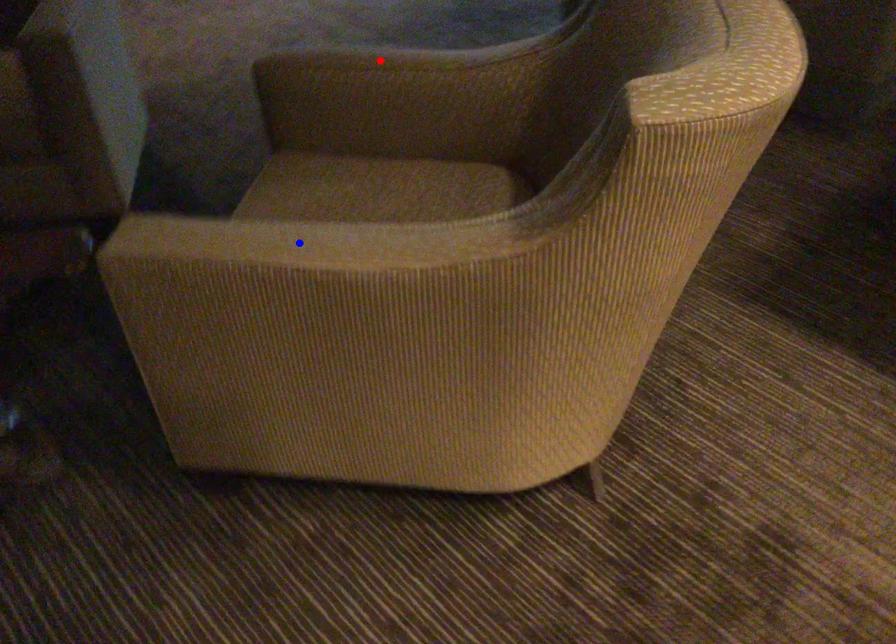
Question: In the image, two points are highlighted. Which point is nearer to the camera? Reply with the corresponding letter.

Choices:
 (A) blue point
 (B) red point

Answer: (A)